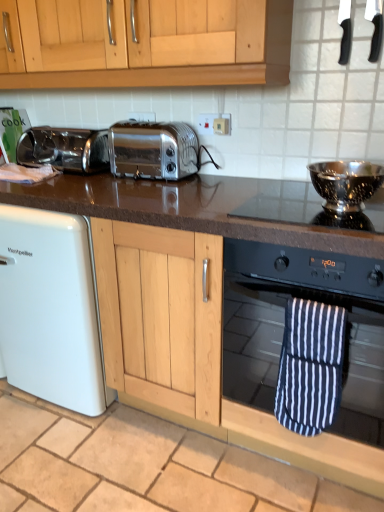
This screenshot has height=512, width=384. Identify the location of vacant area on top of beige tile at lower center (from a real-world perspective). (127, 456).